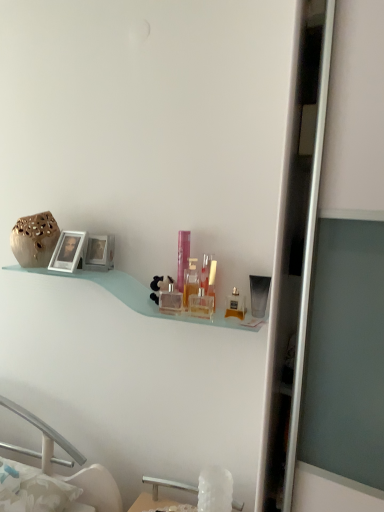
Question: Considering the relative positions of clear plastic bottle at center, the 4th toiletry when ordered from right to left, and matte gold perfume at center, placed as the 7th toiletry when sorted from left to right, in the image provided, is clear plastic bottle at center, the 4th toiletry when ordered from right to left, to the right of matte gold perfume at center, placed as the 7th toiletry when sorted from left to right, from the viewer's perspective?

Choices:
 (A) yes
 (B) no

Answer: (B)

Question: Does clear plastic bottle at center, the 5th toiletry from the left, come in front of matte gold perfume at center, placed as the 7th toiletry when sorted from left to right?

Choices:
 (A) no
 (B) yes

Answer: (A)

Question: From a real-world perspective, is clear plastic bottle at center, the 4th toiletry when ordered from right to left, physically below matte gold perfume at center, which appears as the 2th toiletry when viewed from the right?

Choices:
 (A) no
 (B) yes

Answer: (A)

Question: Considering the relative sizes of clear plastic bottle at center, the 5th toiletry from the left, and matte gold perfume at center, placed as the 7th toiletry when sorted from left to right, in the image provided, is clear plastic bottle at center, the 5th toiletry from the left, bigger than matte gold perfume at center, placed as the 7th toiletry when sorted from left to right,?

Choices:
 (A) yes
 (B) no

Answer: (A)

Question: Is clear plastic bottle at center, the 5th toiletry from the left, facing towards matte gold perfume at center, placed as the 7th toiletry when sorted from left to right?

Choices:
 (A) no
 (B) yes

Answer: (A)

Question: Considering the positions of point (188, 231) and point (203, 276), is point (188, 231) closer or farther from the camera than point (203, 276)?

Choices:
 (A) farther
 (B) closer

Answer: (A)

Question: Is pink glass perfume bottle at center, marked as the 7th toiletry in a right-to-left arrangement, in front of or behind clear plastic bottle at center, the 5th toiletry from the left, in the image?

Choices:
 (A) front
 (B) behind

Answer: (B)

Question: Considering the positions of pink glass perfume bottle at center, marked as the 7th toiletry in a right-to-left arrangement, and clear plastic bottle at center, the 4th toiletry when ordered from right to left, in the image, is pink glass perfume bottle at center, marked as the 7th toiletry in a right-to-left arrangement, taller or shorter than clear plastic bottle at center, the 4th toiletry when ordered from right to left,?

Choices:
 (A) tall
 (B) short

Answer: (A)

Question: Considering the positions of pink glass perfume bottle at center, which appears as the 2th toiletry when viewed from the left, and clear plastic bottle at center, the 5th toiletry from the left, in the image, is pink glass perfume bottle at center, which appears as the 2th toiletry when viewed from the left, wider or thinner than clear plastic bottle at center, the 5th toiletry from the left,?

Choices:
 (A) thin
 (B) wide

Answer: (A)

Question: Based on their positions, is satin black tube at upper right, which ranks as the first toiletry in right-to-left order, located to the left or right of clear glass perfume bottle at center, the fourth toiletry in the left-to-right sequence?

Choices:
 (A) left
 (B) right

Answer: (B)

Question: Considering the positions of satin black tube at upper right, arranged as the eighth toiletry when viewed from the left, and clear glass perfume bottle at center, positioned as the fifth toiletry in right-to-left order, in the image, is satin black tube at upper right, arranged as the eighth toiletry when viewed from the left, taller or shorter than clear glass perfume bottle at center, positioned as the fifth toiletry in right-to-left order,?

Choices:
 (A) short
 (B) tall

Answer: (B)

Question: From a real-world perspective, relative to clear glass perfume bottle at center, the fourth toiletry in the left-to-right sequence, is satin black tube at upper right, which ranks as the first toiletry in right-to-left order, vertically above or below?

Choices:
 (A) below
 (B) above

Answer: (B)

Question: From the image's perspective, is satin black tube at upper right, which ranks as the first toiletry in right-to-left order, located above or below clear glass perfume bottle at center, positioned as the fifth toiletry in right-to-left order?

Choices:
 (A) below
 (B) above

Answer: (B)

Question: Is point (61, 258) closer or farther from the camera than point (193, 488)?

Choices:
 (A) closer
 (B) farther

Answer: (A)

Question: Which is correct: silver metallic picture frame at left, acting as the first picture frame starting from the left, is inside white crystal sink at lower center, or outside of it?

Choices:
 (A) inside
 (B) outside

Answer: (B)